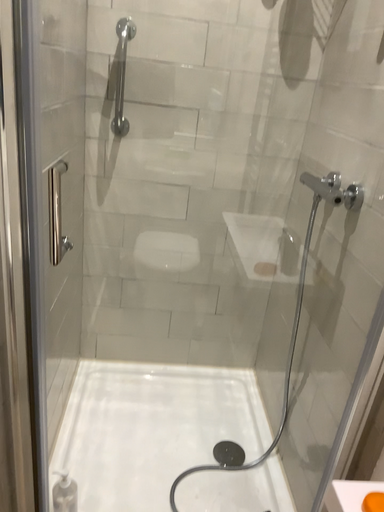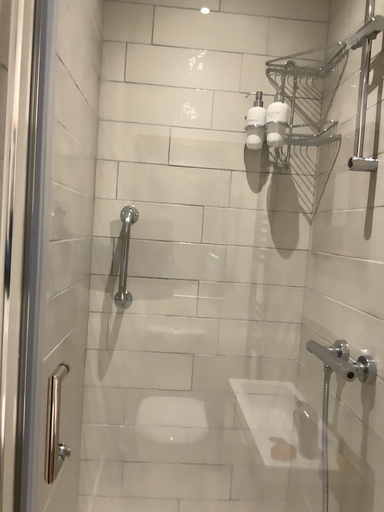
Question: Which way did the camera rotate in the video?

Choices:
 (A) rotated upward
 (B) rotated downward

Answer: (A)